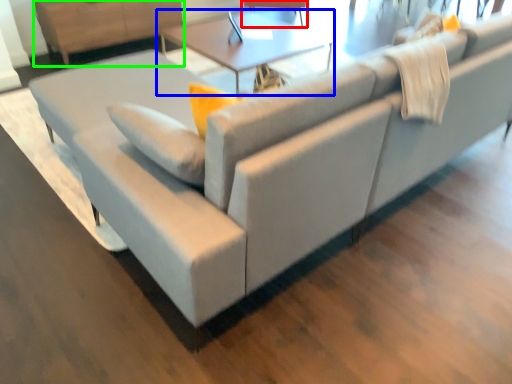
Question: Based on their relative distances, which object is farther from swivel chair (highlighted by a red box)? Choose from table (highlighted by a blue box) and dresser (highlighted by a green box).

Choices:
 (A) table
 (B) dresser

Answer: (B)